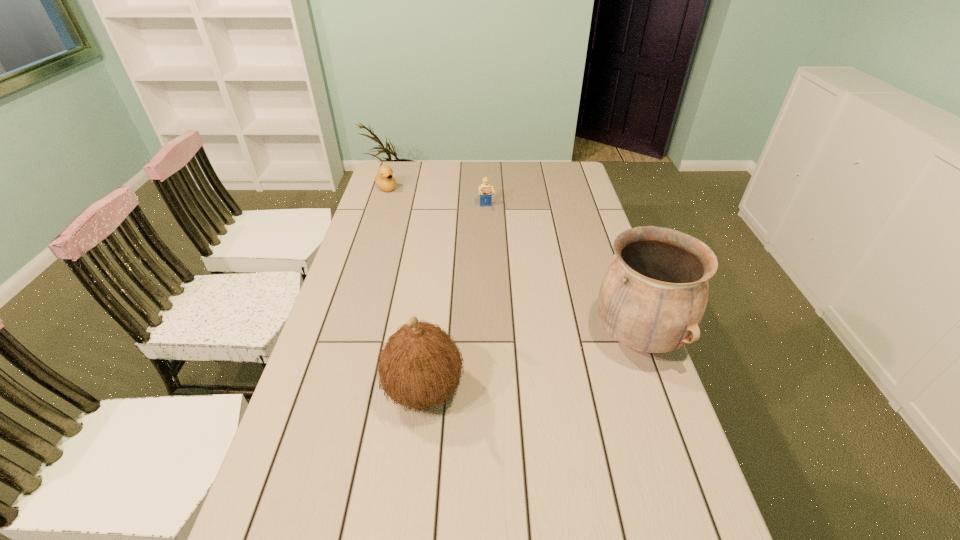
Locate an element on the screen. The width and height of the screenshot is (960, 540). free space at the far edge of the desktop is located at coordinates (447, 175).

In the image, there is a desktop. Where is `free space at the near edge`? This screenshot has height=540, width=960. free space at the near edge is located at coordinates coord(444,502).

Identify the location of free space at the left edge. (392, 249).

This screenshot has width=960, height=540. What are the coordinates of `vacant space at the right edge` in the screenshot? It's located at (581, 219).

Find the location of a particular element. This screenshot has width=960, height=540. free region at the near right corner of the desktop is located at coordinates (664, 536).

At what (x,y) coordinates should I click in order to perform the action: click on vacant space that's between the second farthest object and the duckling. Please return your answer as a coordinate pair (x, y). The width and height of the screenshot is (960, 540). Looking at the image, I should click on (436, 198).

You are a GUI agent. You are given a task and a screenshot of the screen. Output one action in this format:
    pyautogui.click(x=<x>, y=<y>)
    Task: Click on the vacant point located between the rightmost object and the third object from right to left
    This screenshot has height=540, width=960.
    Given the screenshot: What is the action you would take?
    pyautogui.click(x=531, y=364)

Identify the location of empty space between the farthest object and the coconut. Image resolution: width=960 pixels, height=540 pixels. (405, 289).

Where is `free space between the second farthest object and the farthest object`? free space between the second farthest object and the farthest object is located at coordinates (436, 198).

At what (x,y) coordinates should I click in order to perform the action: click on free space between the leftmost object and the third object from right to left. Please return your answer as a coordinate pair (x, y). This screenshot has width=960, height=540. Looking at the image, I should click on (405, 289).